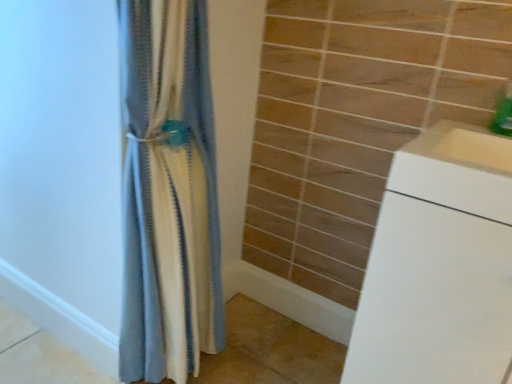
This screenshot has width=512, height=384. In order to click on vacant area that is situated to the right of blue textured fabric at center in this screenshot , I will do `click(264, 358)`.